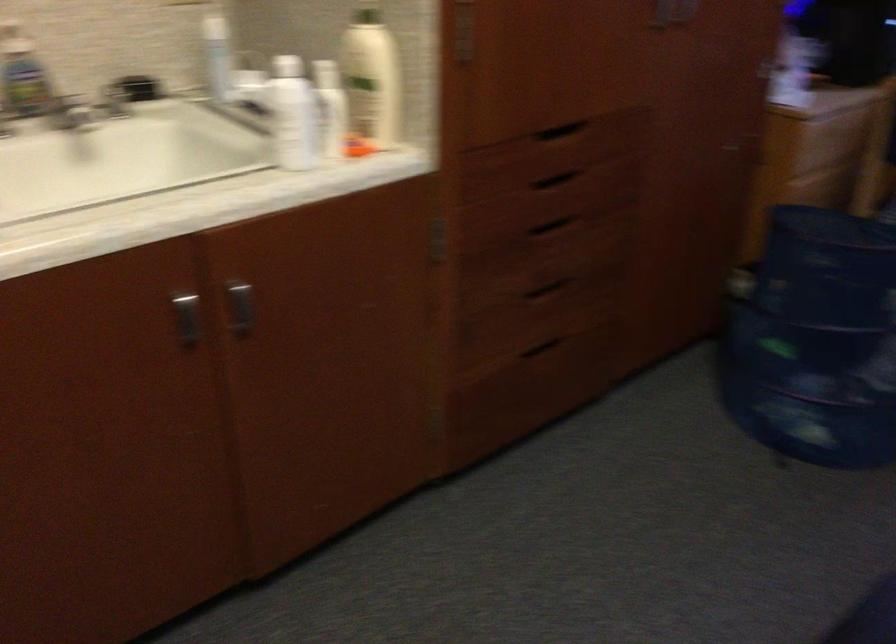
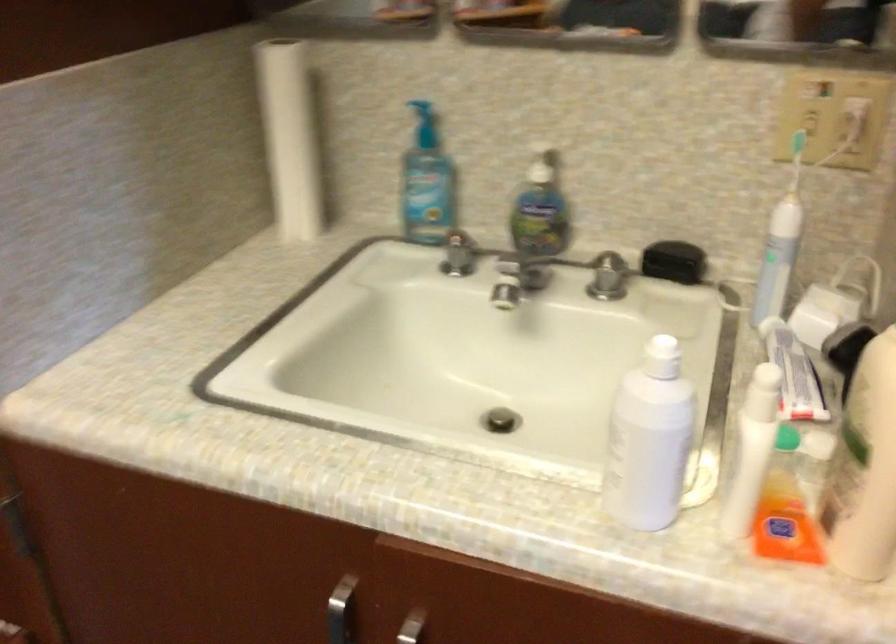
Find the pixel in the second image that matches point 116,102 in the first image.

(607, 277)